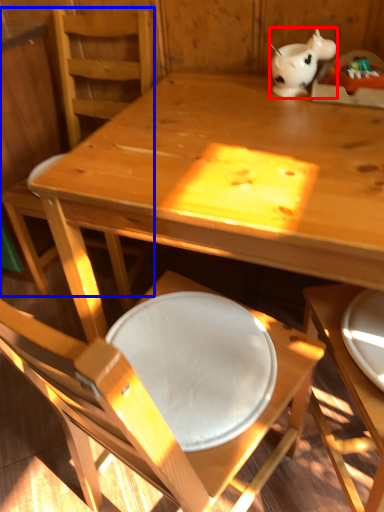
Question: Among these objects, which one is nearest to the camera, tableware (highlighted by a red box) or chair (highlighted by a blue box)?

Choices:
 (A) tableware
 (B) chair

Answer: (B)